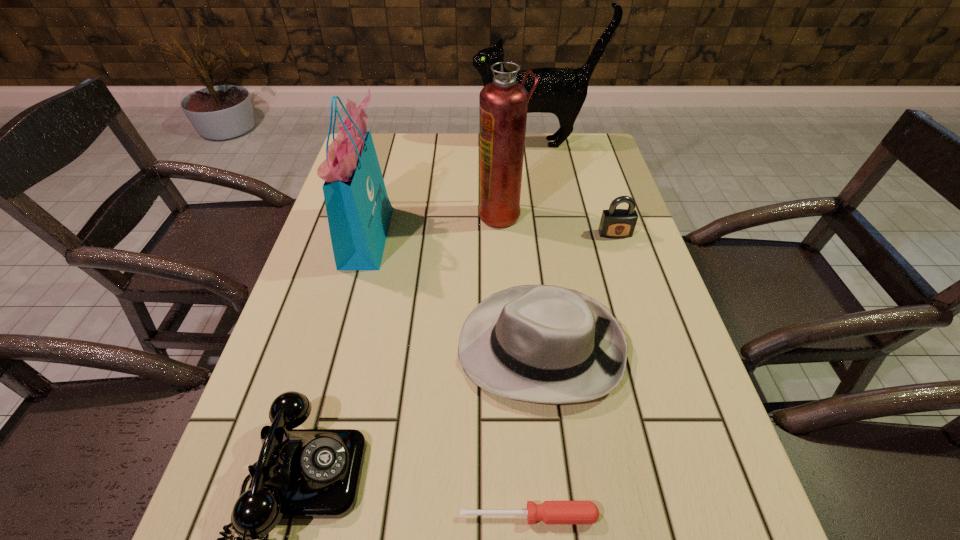
The width and height of the screenshot is (960, 540). What are the coordinates of `the farthest object` in the screenshot? It's located at (560, 91).

Locate an element on the screen. fire extinguisher is located at coordinates (503, 103).

The width and height of the screenshot is (960, 540). Find the location of `shopping bag`. shopping bag is located at coordinates (359, 212).

What are the coordinates of `fedora` in the screenshot? It's located at (544, 344).

The image size is (960, 540). Find the location of `padlock`. padlock is located at coordinates (615, 223).

Find the location of a particular element. Image resolution: width=960 pixels, height=540 pixels. the shortest object is located at coordinates point(550,512).

Locate an element on the screen. free region located 0.100m on the face of the farthest object is located at coordinates (444, 143).

Where is `free region located on the face of the farthest object`? free region located on the face of the farthest object is located at coordinates (393, 143).

Find the location of a particular element. vacant space located on the face of the farthest object is located at coordinates (455, 143).

At what (x,y) coordinates should I click in order to perform the action: click on free space located on the side of the fire extinguisher with the label. Please return your answer as a coordinate pair (x, y). This screenshot has height=540, width=960. Looking at the image, I should click on (x=355, y=214).